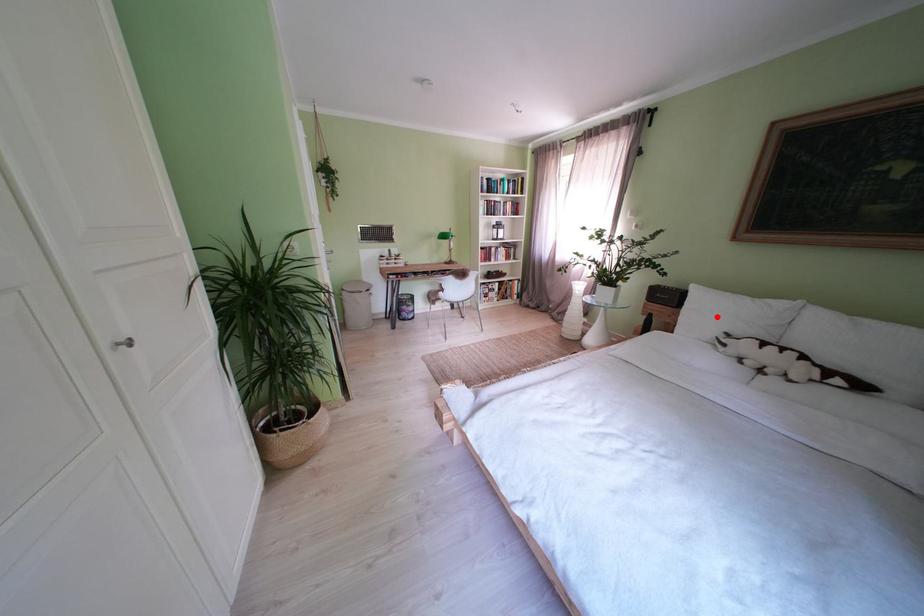
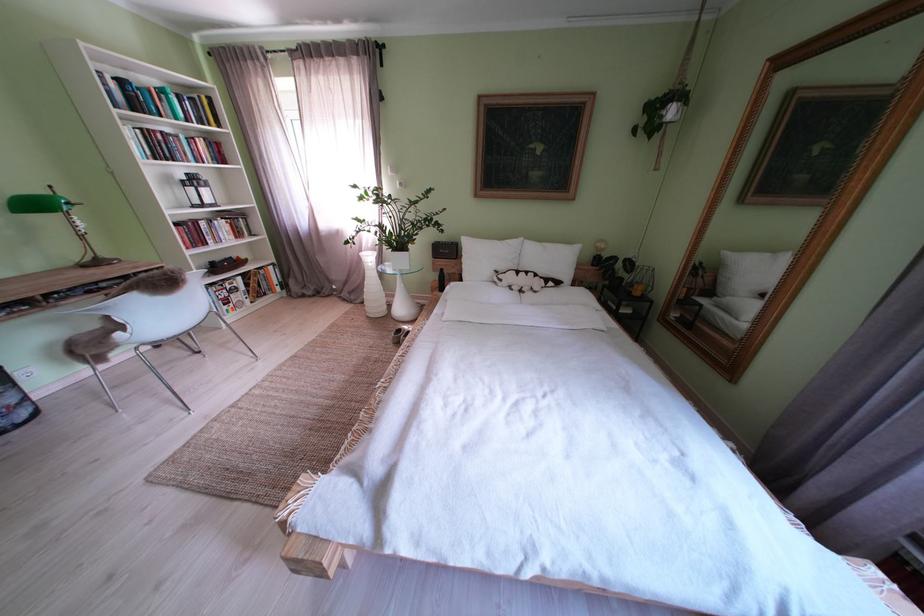
Find the pixel in the second image that matches the highlighted location in the first image.

(490, 262)